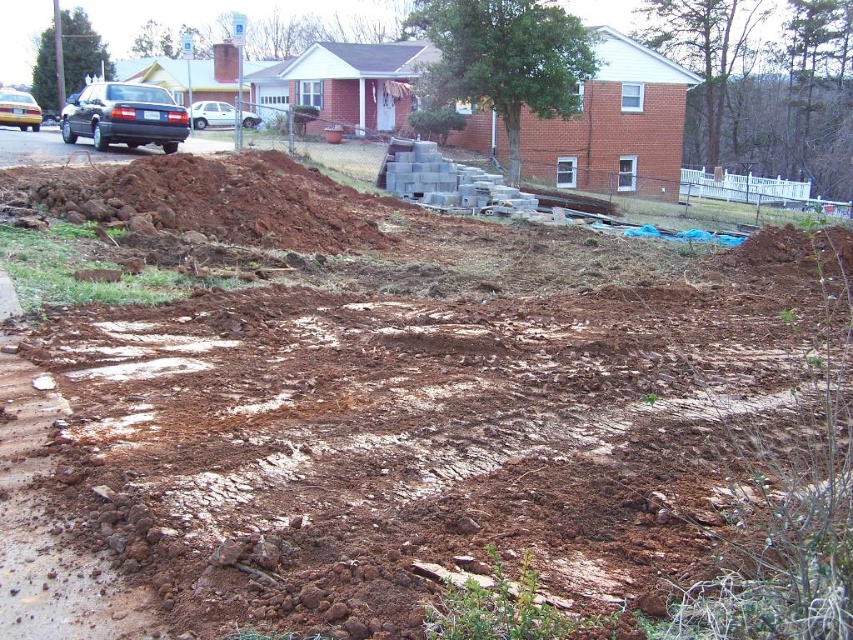
Question: Can you confirm if brown dirt mound at left is positioned to the right of white matte car at upper left?

Choices:
 (A) yes
 (B) no

Answer: (A)

Question: Can you confirm if brown dirt mound at left is positioned above matte blue sedan at left?

Choices:
 (A) yes
 (B) no

Answer: (B)

Question: Which of the following is the closest to the observer?

Choices:
 (A) (119, 109)
 (B) (367, 208)
 (C) (231, 116)

Answer: (B)

Question: In this image, where is matte blue sedan at left located relative to white matte car at upper left?

Choices:
 (A) left
 (B) right

Answer: (A)

Question: Among these points, which one is farthest from the camera?

Choices:
 (A) (39, 120)
 (B) (202, 108)
 (C) (70, 124)
 (D) (238, 214)

Answer: (B)

Question: Which point is closer to the camera taking this photo?

Choices:
 (A) (120, 93)
 (B) (73, 172)

Answer: (B)